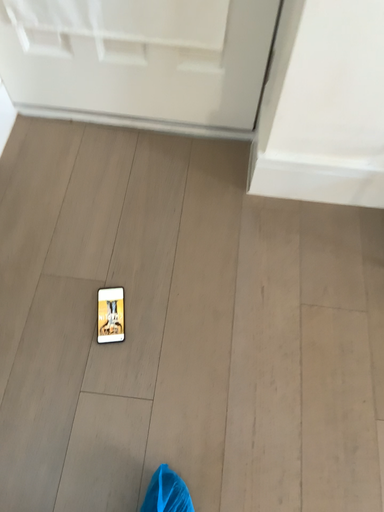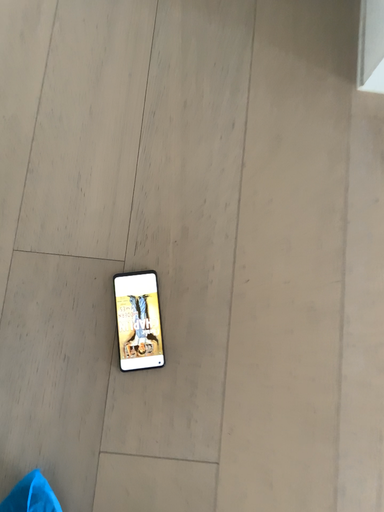
Question: Which way did the camera rotate in the video?

Choices:
 (A) rotated downward
 (B) rotated upward

Answer: (A)